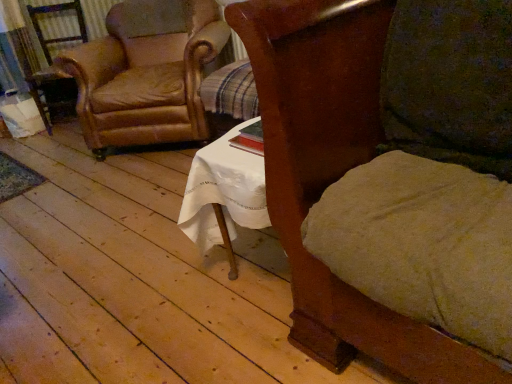
Question: Considering the relative sizes of leather armchair at left and leather at left, arranged as the first chair when viewed from the back, in the image provided, is leather armchair at left taller than leather at left, arranged as the first chair when viewed from the back,?

Choices:
 (A) yes
 (B) no

Answer: (B)

Question: Is leather at left, acting as the second chair starting from the right, completely or partially inside leather armchair at left?

Choices:
 (A) yes
 (B) no

Answer: (B)

Question: Is leather armchair at left bigger than leather at left, acting as the second chair starting from the right?

Choices:
 (A) no
 (B) yes

Answer: (A)

Question: Considering the relative sizes of leather armchair at left and leather at left, arranged as the first chair when viewed from the back, in the image provided, is leather armchair at left wider than leather at left, arranged as the first chair when viewed from the back,?

Choices:
 (A) yes
 (B) no

Answer: (B)

Question: From a real-world perspective, is leather armchair at left located higher than leather at left, acting as the second chair starting from the right?

Choices:
 (A) no
 (B) yes

Answer: (A)

Question: Is leather armchair at left further to the viewer compared to leather at left, which appears as the first chair when viewed from the left?

Choices:
 (A) yes
 (B) no

Answer: (A)

Question: Would you say wooden chair at center, the 2th chair from the left, is a long distance from leather at left, acting as the second chair starting from the right?

Choices:
 (A) no
 (B) yes

Answer: (B)

Question: Is wooden chair at center, arranged as the first chair when viewed from the front, thinner than leather at left, which appears as the first chair when viewed from the left?

Choices:
 (A) no
 (B) yes

Answer: (B)

Question: Does wooden chair at center, which is the first chair in right-to-left order, have a greater height compared to leather at left, the second chair when ordered from front to back?

Choices:
 (A) no
 (B) yes

Answer: (B)

Question: Can we say wooden chair at center, which is the first chair in right-to-left order, lies outside leather at left, acting as the second chair starting from the right?

Choices:
 (A) no
 (B) yes

Answer: (B)

Question: From the image's perspective, is wooden chair at center, the 2th chair from the left, located beneath leather at left, the second chair when ordered from front to back?

Choices:
 (A) no
 (B) yes

Answer: (B)

Question: Is wooden chair at center, the 2th chair from the left, shorter than leather at left, which appears as the first chair when viewed from the left?

Choices:
 (A) yes
 (B) no

Answer: (B)

Question: From the image's perspective, is leather armchair at left on top of wooden chair at center, which appears as the second chair when viewed from the back?

Choices:
 (A) no
 (B) yes

Answer: (B)